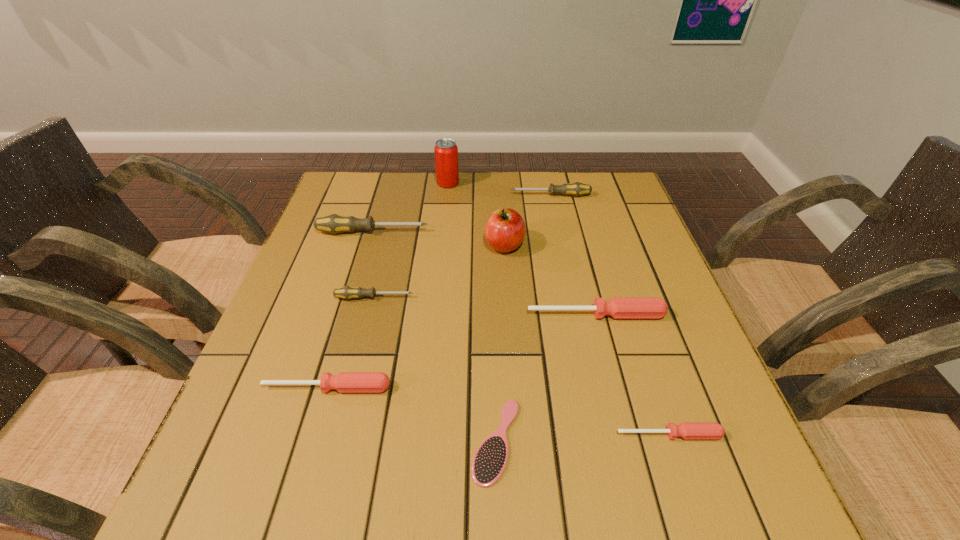
This screenshot has height=540, width=960. Find the location of `object that is positioned at the near edge`. object that is positioned at the near edge is located at coordinates (489, 462).

Locate an element on the screen. The image size is (960, 540). object located in the far right corner section of the desktop is located at coordinates (575, 189).

Where is `free space at the far edge`? The image size is (960, 540). free space at the far edge is located at coordinates (406, 191).

Find the location of a particular element. The width and height of the screenshot is (960, 540). vacant space at the near edge of the desktop is located at coordinates (626, 504).

Identify the location of vacant area at the left edge of the desktop. (286, 303).

This screenshot has width=960, height=540. In the image, there is a desktop. Find the location of `vacant area at the right edge`. vacant area at the right edge is located at coordinates (635, 388).

This screenshot has width=960, height=540. Identify the location of blank space at the far left corner of the desktop. (370, 213).

Where is `free space at the far right corner of the desktop`? This screenshot has width=960, height=540. free space at the far right corner of the desktop is located at coordinates (594, 186).

Find the location of a particular element. The width and height of the screenshot is (960, 540). vacant point located between the hairbrush and the red can is located at coordinates (472, 312).

Image resolution: width=960 pixels, height=540 pixels. What are the coordinates of `vacant area that lies between the red can and the second biggest red screwdriver` in the screenshot? It's located at (388, 285).